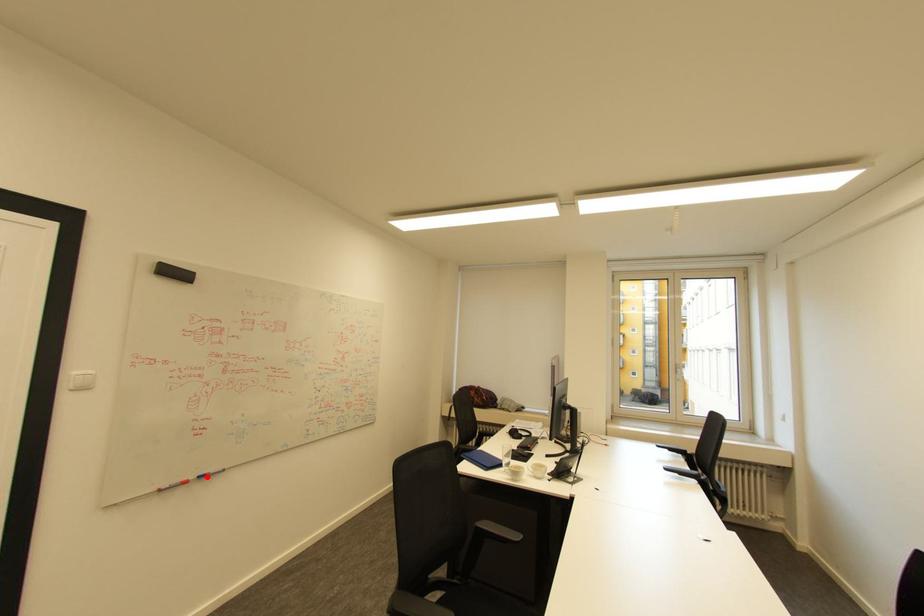
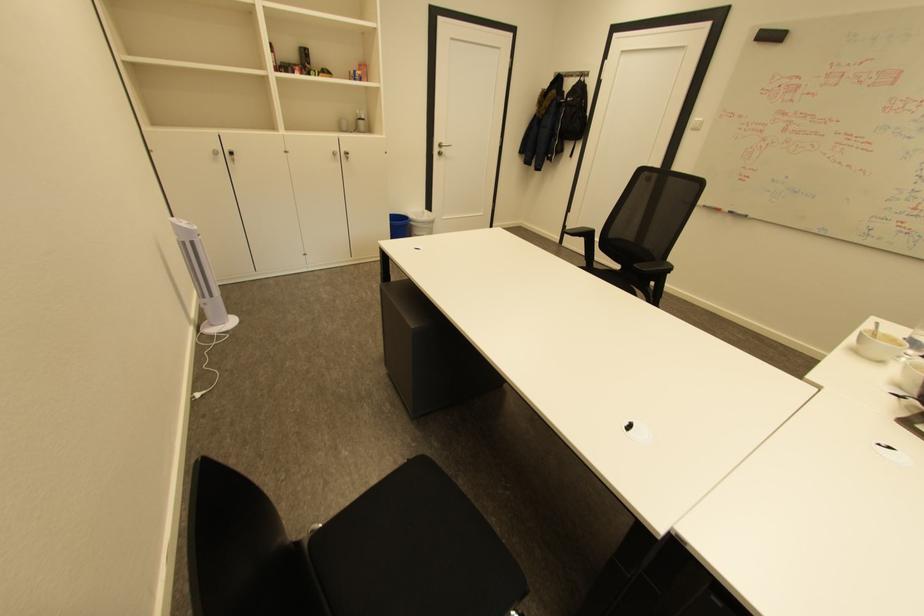
The point at the highlighted location is marked in the first image. Where is the corresponding point in the second image?

(737, 212)